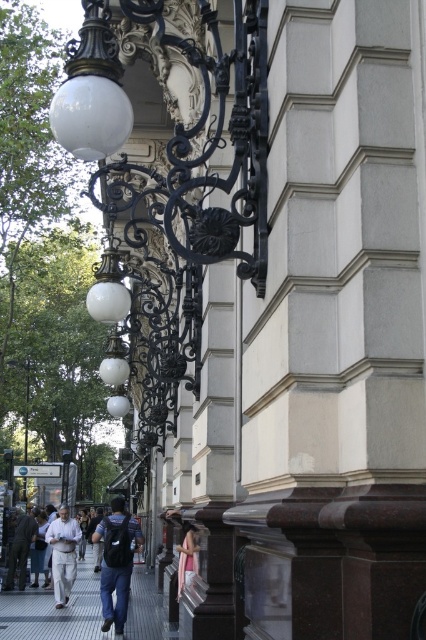
Does gray concrete pavement at lower left have a smaller size compared to dark gray fabric jacket at lower left?

No, gray concrete pavement at lower left is not smaller than dark gray fabric jacket at lower left.

The height and width of the screenshot is (640, 426). I want to click on gray concrete pavement at lower left, so click(54, 611).

You are a GUI agent. You are given a task and a screenshot of the screen. Output one action in this format:
    pyautogui.click(x=<x>, y=<y>)
    Task: Click on the gray concrete pavement at lower left
    
    Given the screenshot: What is the action you would take?
    pyautogui.click(x=54, y=611)

Is dark gray fabric jacket at lower left further to the viewer compared to light pink fabric at lower center?

Yes, dark gray fabric jacket at lower left is behind light pink fabric at lower center.

Who is higher up, dark gray fabric jacket at lower left or light pink fabric at lower center?

light pink fabric at lower center is above.

Is point (31, 512) in front of point (192, 566)?

No, (31, 512) is behind (192, 566).

Identify the location of dark gray fabric jacket at lower left. (20, 547).

Is white cotton shirt at center closer to the viewer compared to matte black street light at lower left?

Yes, white cotton shirt at center is in front of matte black street light at lower left.

Does point (74, 563) come in front of point (23, 365)?

Yes, point (74, 563) is in front of point (23, 365).

Find the location of a particular element. The image size is (426, 640). white cotton shirt at center is located at coordinates (63, 554).